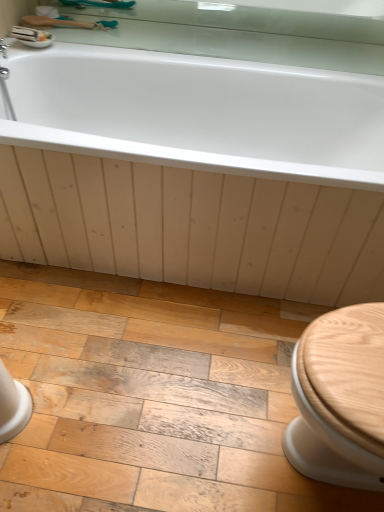
What do you see at coordinates (240, 20) in the screenshot?
I see `clear glass mirror at upper center` at bounding box center [240, 20].

What do you see at coordinates (66, 23) in the screenshot? The width and height of the screenshot is (384, 512). I see `wooden brush at upper left` at bounding box center [66, 23].

Locate an element on the screen. The width and height of the screenshot is (384, 512). white glossy bathtub at upper center is located at coordinates (195, 170).

The width and height of the screenshot is (384, 512). Describe the element at coordinates (32, 36) in the screenshot. I see `white glossy sink at upper left` at that location.

I want to click on wooden floor at lower center, so click(152, 397).

From a real-world perspective, who is located higher, wooden floor at lower center or white glossy bathtub at upper center?

From a 3D spatial view, white glossy bathtub at upper center is above.

This screenshot has height=512, width=384. I want to click on ceramic tile in front of the white glossy bathtub at upper center, so click(x=152, y=397).

Is wooden floor at lower center at the left side of white glossy bathtub at upper center?

Correct, you'll find wooden floor at lower center to the left of white glossy bathtub at upper center.

Considering the relative sizes of wooden floor at lower center and white glossy bathtub at upper center in the image provided, is wooden floor at lower center bigger than white glossy bathtub at upper center?

No.

Which is more to the right, clear glass mirror at upper center or white glossy bathtub at upper center?

clear glass mirror at upper center is more to the right.

Consider the image. Which of these two, clear glass mirror at upper center or white glossy bathtub at upper center, is smaller?

clear glass mirror at upper center.

Locate an element on the screen. This screenshot has height=512, width=384. mirror on the right of white glossy bathtub at upper center is located at coordinates (240, 20).

Based on their positions, is wooden floor at lower center located to the left or right of wooden brush at upper left?

Based on their positions, wooden floor at lower center is located to the right of wooden brush at upper left.

Is wooden floor at lower center directly adjacent to wooden brush at upper left?

wooden floor at lower center is not next to wooden brush at upper left, and they're not touching.

Which of these two, wooden floor at lower center or wooden brush at upper left, is wider?

wooden floor at lower center is wider.

From a real-world perspective, which object rests below the other?

In real-world perspective, wooden floor at lower center is lower.

Identify the location of mirror on the right of wooden floor at lower center. Image resolution: width=384 pixels, height=512 pixels. 240,20.

In the image, is clear glass mirror at upper center positioned in front of or behind wooden floor at lower center?

Clearly, clear glass mirror at upper center is behind wooden floor at lower center.

Is clear glass mirror at upper center not near wooden floor at lower center?

Yes, clear glass mirror at upper center and wooden floor at lower center are located far from each other.

This screenshot has width=384, height=512. In order to click on ceramic tile that is below the wooden brush at upper left (from the image's perspective) in this screenshot , I will do `click(152, 397)`.

Does wooden brush at upper left turn towards wooden floor at lower center?

No, wooden brush at upper left is not aimed at wooden floor at lower center.

Would you say wooden floor at lower center is part of wooden brush at upper left's contents?

That's incorrect, wooden floor at lower center is not inside wooden brush at upper left.

Is white glossy sink at upper left outside of white glossy bathtub at upper center?

That's correct, white glossy sink at upper left is outside of white glossy bathtub at upper center.

From a real-world perspective, relative to white glossy bathtub at upper center, is white glossy sink at upper left vertically above or below?

In terms of real-world spatial position, white glossy sink at upper left is above white glossy bathtub at upper center.

Is white glossy bathtub at upper center at the back of white glossy sink at upper left?

That's not correct — white glossy sink at upper left is not looking away from white glossy bathtub at upper center.

Is clear glass mirror at upper center to the left or to the right of white glossy sink at upper left in the image?

Based on their positions, clear glass mirror at upper center is located to the right of white glossy sink at upper left.

Find the location of a particular element. The width and height of the screenshot is (384, 512). sink on the left of clear glass mirror at upper center is located at coordinates (32, 36).

Is clear glass mirror at upper center next to white glossy sink at upper left and touching it?

clear glass mirror at upper center is not next to white glossy sink at upper left, and they're not touching.

From a real-world perspective, which object stands above the other?

clear glass mirror at upper center, from a real-world perspective.

Locate an element on the screen. The height and width of the screenshot is (512, 384). bathtub on the right side of wooden floor at lower center is located at coordinates (195, 170).

You are a GUI agent. You are given a task and a screenshot of the screen. Output one action in this format:
    pyautogui.click(x=<x>, y=<y>)
    Task: Click on the bathtub located underneath the clear glass mirror at upper center (from a real-world perspective)
    
    Given the screenshot: What is the action you would take?
    pyautogui.click(x=195, y=170)

When comparing their distances from white glossy sink at upper left, does wooden floor at lower center or wooden brush at upper left seem closer?

wooden brush at upper left lies closer to white glossy sink at upper left than the other object.

Estimate the real-world distances between objects in this image. Which object is closer to wooden floor at lower center, white glossy bathtub at upper center or wooden brush at upper left?

white glossy bathtub at upper center.

When comparing their distances from clear glass mirror at upper center, does white glossy bathtub at upper center or white glossy sink at upper left seem further?

Based on the image, white glossy bathtub at upper center appears to be further to clear glass mirror at upper center.

When comparing their distances from clear glass mirror at upper center, does white glossy sink at upper left or wooden floor at lower center seem closer?

white glossy sink at upper left lies closer to clear glass mirror at upper center than the other object.

From the image, which object appears to be nearer to white glossy sink at upper left, wooden brush at upper left or wooden floor at lower center?

Among the two, wooden brush at upper left is located nearer to white glossy sink at upper left.

Considering their positions, is clear glass mirror at upper center positioned further to wooden brush at upper left than white glossy bathtub at upper center?

white glossy bathtub at upper center is positioned further to the anchor wooden brush at upper left.

Looking at the image, which one is located further to wooden floor at lower center, clear glass mirror at upper center or wooden brush at upper left?

clear glass mirror at upper center.

Considering their positions, is wooden brush at upper left positioned further to white glossy bathtub at upper center than wooden floor at lower center?

wooden brush at upper left.

The height and width of the screenshot is (512, 384). What are the coordinates of `sink that lies between wooden brush at upper left and white glossy bathtub at upper center from top to bottom` in the screenshot? It's located at (32, 36).

Where is `sink that lies between wooden brush at upper left and wooden floor at lower center from top to bottom`? This screenshot has width=384, height=512. sink that lies between wooden brush at upper left and wooden floor at lower center from top to bottom is located at coordinates (32, 36).

You are a GUI agent. You are given a task and a screenshot of the screen. Output one action in this format:
    pyautogui.click(x=<x>, y=<y>)
    Task: Click on the shower between clear glass mirror at upper center and wooden floor at lower center vertically
    Image resolution: width=384 pixels, height=512 pixels.
    Given the screenshot: What is the action you would take?
    pyautogui.click(x=66, y=23)

Where is `sink that lies between clear glass mirror at upper center and white glossy bathtub at upper center from top to bottom`? The width and height of the screenshot is (384, 512). sink that lies between clear glass mirror at upper center and white glossy bathtub at upper center from top to bottom is located at coordinates (32, 36).